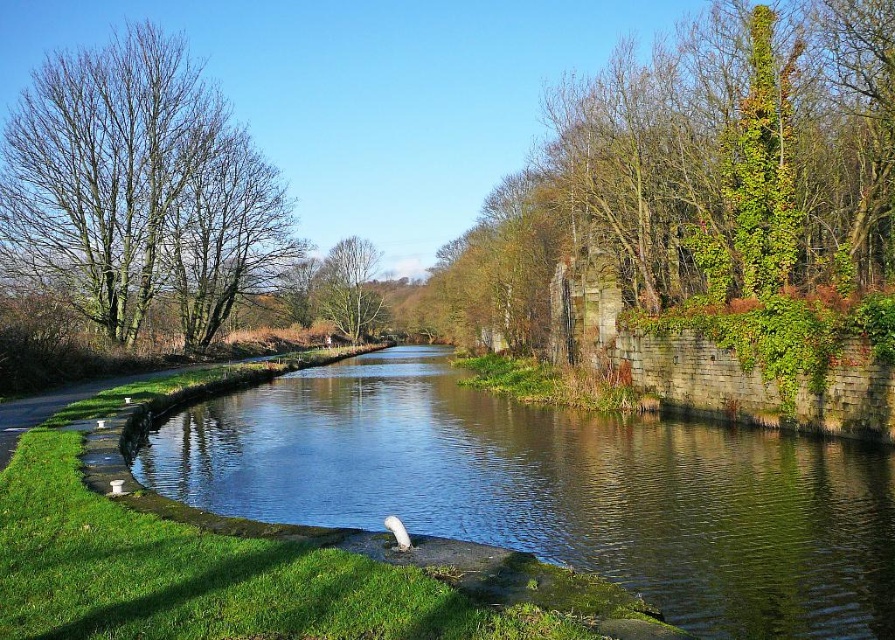
Question: Is green stone river at center bigger than green leafy tree at center?

Choices:
 (A) yes
 (B) no

Answer: (B)

Question: Does green stone river at center have a smaller size compared to green leafy tree at left?

Choices:
 (A) no
 (B) yes

Answer: (B)

Question: Based on their relative distances, which object is farther from the green leafy tree at left?

Choices:
 (A) green leafy tree at center
 (B) green stone river at center

Answer: (A)

Question: Is green stone river at center to the right of green leafy tree at left from the viewer's perspective?

Choices:
 (A) no
 (B) yes

Answer: (B)

Question: Which point appears farthest from the camera in this image?

Choices:
 (A) (371, 244)
 (B) (130, 157)
 (C) (362, 420)

Answer: (A)

Question: Which of the following is the closest to the observer?

Choices:
 (A) green stone river at center
 (B) green leafy tree at left
 (C) green leafy tree at center

Answer: (A)